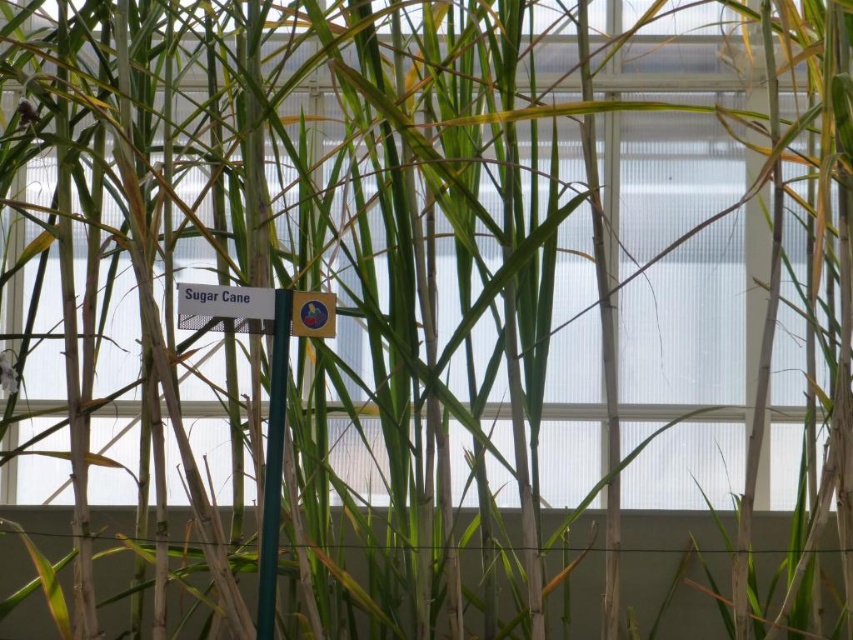
Question: Does green matte pole at center have a smaller size compared to matte plastic sign at center?

Choices:
 (A) no
 (B) yes

Answer: (A)

Question: Among these points, which one is nearest to the camera?

Choices:
 (A) (293, 328)
 (B) (270, 422)

Answer: (B)

Question: Is green matte pole at center above matte plastic sign at center?

Choices:
 (A) yes
 (B) no

Answer: (B)

Question: Does green matte pole at center have a larger size compared to matte plastic sign at center?

Choices:
 (A) no
 (B) yes

Answer: (B)

Question: Which point is farther to the camera?

Choices:
 (A) matte plastic sign at center
 (B) green matte pole at center

Answer: (A)

Question: Which point is closer to the camera taking this photo?

Choices:
 (A) (293, 296)
 (B) (280, 429)

Answer: (B)